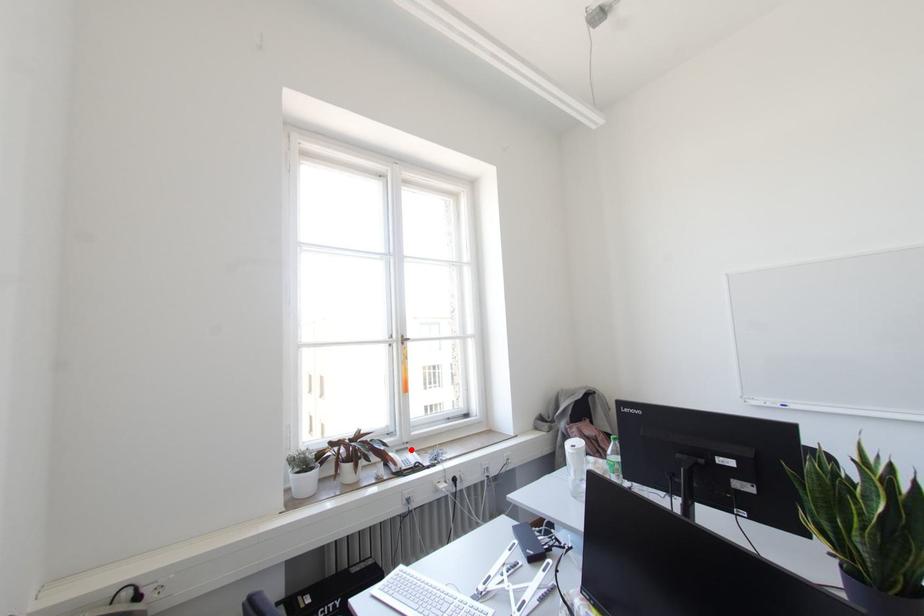
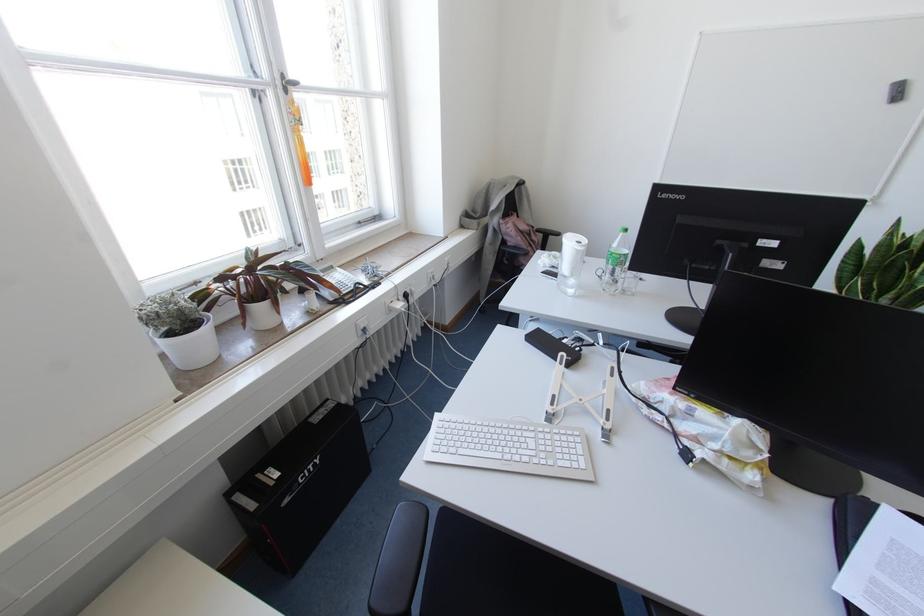
Locate, in the second image, the point that corresponds to the highlighted location in the first image.

(336, 268)